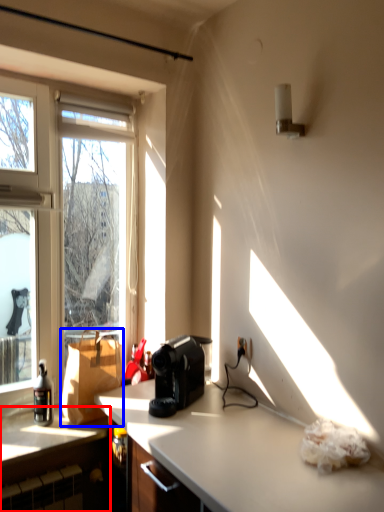
Question: Which point is further to the camera, cabinetry (highlighted by a red box) or cardboard box (highlighted by a blue box)?

Choices:
 (A) cabinetry
 (B) cardboard box

Answer: (B)